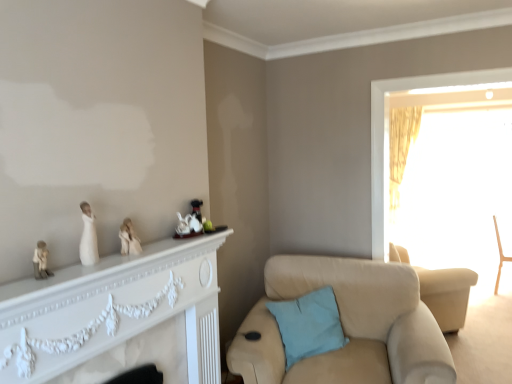
Where is `vacant area that is situated to the right of white matte figurine at left, placed as the first toy when sorted from front to back`? The width and height of the screenshot is (512, 384). vacant area that is situated to the right of white matte figurine at left, placed as the first toy when sorted from front to back is located at coordinates (86, 273).